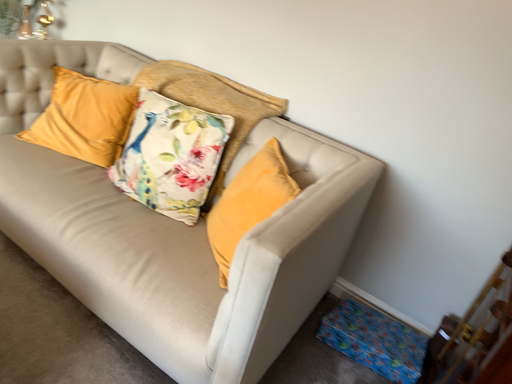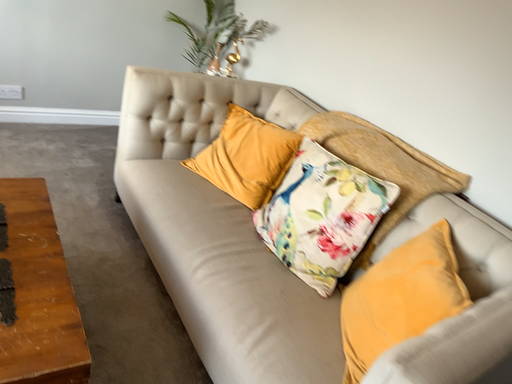
Question: How did the camera likely rotate when shooting the video?

Choices:
 (A) rotated left
 (B) rotated right

Answer: (A)